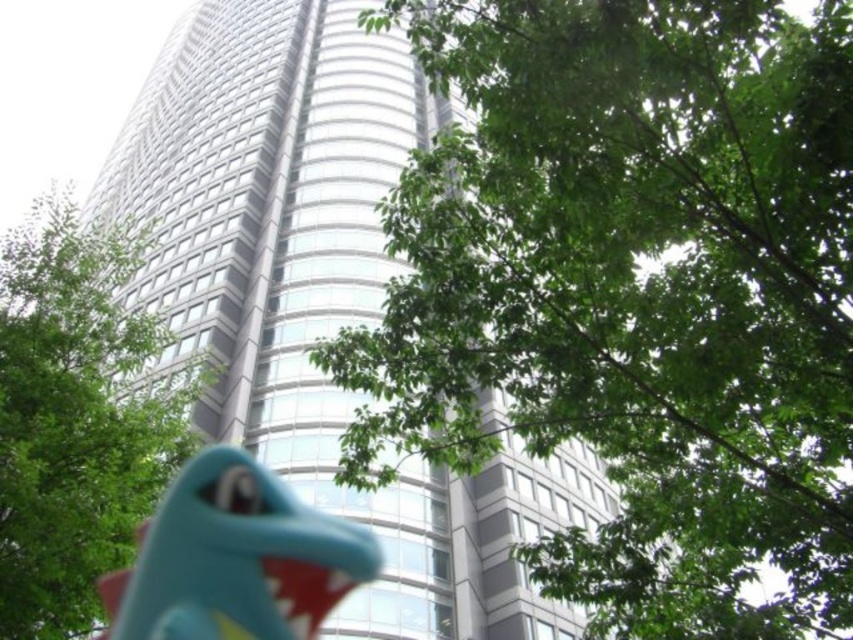
Is point (723, 499) closer to viewer compared to point (267, 452)?

That is True.

This screenshot has height=640, width=853. Identify the location of green leafy tree at center. (634, 294).

Is point (618, 595) less distant than point (416, 464)?

That is True.

The width and height of the screenshot is (853, 640). Find the location of `green leafy tree at center`. green leafy tree at center is located at coordinates (634, 294).

Is glassy silver tower at center to the right of teal rubber dinosaur at lower center from the viewer's perspective?

In fact, glassy silver tower at center is to the left of teal rubber dinosaur at lower center.

Is glassy silver tower at center taller than teal rubber dinosaur at lower center?

Indeed, glassy silver tower at center has a greater height compared to teal rubber dinosaur at lower center.

Is point (395, 572) closer to viewer compared to point (144, 593)?

No, it is not.

The image size is (853, 640). In order to click on glassy silver tower at center in this screenshot , I will do `click(323, 296)`.

Which is more to the left, green leafy tree at center or teal rubber dinosaur at lower center?

teal rubber dinosaur at lower center

How far apart are green leafy tree at center and teal rubber dinosaur at lower center?

green leafy tree at center and teal rubber dinosaur at lower center are 12.57 meters apart.

Which is in front, point (669, 632) or point (287, 531)?

Point (669, 632) is more forward.

You are a GUI agent. You are given a task and a screenshot of the screen. Output one action in this format:
    pyautogui.click(x=<x>, y=<y>)
    Task: Click on the green leafy tree at center
    
    Given the screenshot: What is the action you would take?
    pyautogui.click(x=634, y=294)